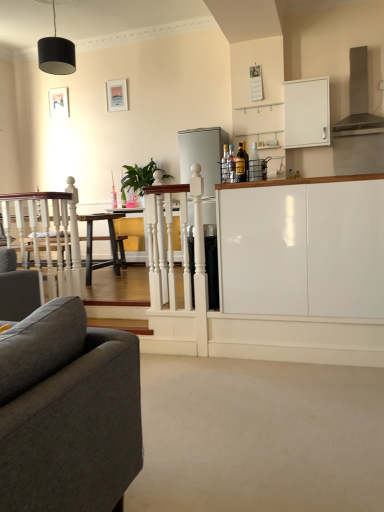
You are a GUI agent. You are given a task and a screenshot of the screen. Output one action in this format:
    pyautogui.click(x=<x>, y=<y>)
    Task: Click on the white wooden railing at center
    Image resolution: width=384 pixels, height=512 pixels.
    Given the screenshot: What is the action you would take?
    (183, 253)

Identify the location of black matte lampshade at upper center. (56, 53).

Measure the distance between black matte lampshade at upper center and camera.

black matte lampshade at upper center and camera are 3.29 meters apart.

At what (x,y) coordinates should I click in order to perform the action: click on satin silver refrigerator at center. Please return your answer as a coordinate pair (x, y). This screenshot has width=384, height=512. Looking at the image, I should click on (202, 155).

The image size is (384, 512). What do you see at coordinates (59, 102) in the screenshot?
I see `matte white picture frame at upper left, placed as the second picture frame when sorted from right to left` at bounding box center [59, 102].

Identify the location of matte white picture frame at upper center, the first picture frame when ordered from front to back. (117, 95).

Describe the element at coordinates (307, 113) in the screenshot. This screenshot has width=384, height=512. I see `white glossy cabinet at upper right, marked as the first cabinetry in a back-to-front arrangement` at that location.

Locate an element on the screen. This screenshot has width=384, height=512. white wooden railing at center is located at coordinates (183, 253).

Who is smaller, white glossy table at center or matte white picture frame at upper left, which ranks as the 2th picture frame in front-to-back order?

matte white picture frame at upper left, which ranks as the 2th picture frame in front-to-back order, is smaller.

Does white glossy table at center have a lesser height compared to matte white picture frame at upper left, which ranks as the 2th picture frame in front-to-back order?

Incorrect, the height of white glossy table at center does not fall short of that of matte white picture frame at upper left, which ranks as the 2th picture frame in front-to-back order.

Is white glossy table at center further to camera compared to matte white picture frame at upper left, placed as the second picture frame when sorted from right to left?

No, it is not.

Is white glossy table at center at the back of satin silver refrigerator at center?

No, satin silver refrigerator at center is not facing away from white glossy table at center.

Is satin silver refrigerator at center not within white glossy table at center?

Indeed, satin silver refrigerator at center is completely outside white glossy table at center.

From the picture: Which object is positioned more to the left, satin silver refrigerator at center or white glossy table at center?

white glossy table at center.

Considering the relative positions of matte gray exhaust hood at upper right and black matte lampshade at upper center in the image provided, is matte gray exhaust hood at upper right to the right of black matte lampshade at upper center from the viewer's perspective?

Yes, matte gray exhaust hood at upper right is to the right of black matte lampshade at upper center.

From a real-world perspective, is matte gray exhaust hood at upper right beneath black matte lampshade at upper center?

Yes, from a real-world perspective, matte gray exhaust hood at upper right is below black matte lampshade at upper center.

Considering the sizes of objects matte gray exhaust hood at upper right and black matte lampshade at upper center in the image provided, who is wider, matte gray exhaust hood at upper right or black matte lampshade at upper center?

matte gray exhaust hood at upper right.

Is matte white picture frame at upper center, the first picture frame when ordered from front to back, to the left of white glossy table at center from the viewer's perspective?

Yes, matte white picture frame at upper center, the first picture frame when ordered from front to back, is to the left of white glossy table at center.

Which object is wider, matte white picture frame at upper center, which appears as the second picture frame when viewed from the back, or white glossy table at center?

With larger width is white glossy table at center.

At what (x,y) coordinates should I click in order to perform the action: click on the 2nd picture frame above the white glossy table at center (from the image's perspective). Please return your answer as a coordinate pair (x, y). This screenshot has height=512, width=384. Looking at the image, I should click on (117, 95).

Would you say matte white picture frame at upper center, which appears as the second picture frame when viewed from the back, is inside or outside white glossy table at center?

matte white picture frame at upper center, which appears as the second picture frame when viewed from the back, cannot be found inside white glossy table at center.

Between white glossy cabinet at upper right, the 1th cabinetry when ordered from top to bottom, and matte white picture frame at upper center, the first picture frame when ordered from front to back, which one is positioned in front?

white glossy cabinet at upper right, the 1th cabinetry when ordered from top to bottom.

Does white glossy cabinet at upper right, which appears as the 2th cabinetry when ordered from the bottom, turn towards matte white picture frame at upper center, which appears as the second picture frame when viewed from the back?

No, white glossy cabinet at upper right, which appears as the 2th cabinetry when ordered from the bottom, is not facing towards matte white picture frame at upper center, which appears as the second picture frame when viewed from the back.

Would you say matte white picture frame at upper center, which appears as the second picture frame when viewed from the back, is part of white glossy cabinet at upper right, which appears as the 2th cabinetry when ordered from the bottom,'s contents?

No, matte white picture frame at upper center, which appears as the second picture frame when viewed from the back, is not inside white glossy cabinet at upper right, which appears as the 2th cabinetry when ordered from the bottom.

Which of these two, white glossy cabinet at upper right, the 1th cabinetry when ordered from top to bottom, or matte white picture frame at upper center, the first picture frame when ordered from front to back, stands shorter?

With less height is matte white picture frame at upper center, the first picture frame when ordered from front to back.

Is matte white picture frame at upper center, which appears as the second picture frame when viewed from the back, in front of white glossy cabinet at center, placed as the first cabinetry when sorted from front to back?

That is False.

Starting from the white glossy cabinet at center, placed as the first cabinetry when sorted from front to back, which picture frame is the 1st one behind? Please provide its 2D coordinates.

[(117, 95)]

Can you confirm if matte white picture frame at upper center, the first picture frame when ordered from front to back, is positioned to the right of white glossy cabinet at center, which appears as the second cabinetry when viewed from the top?

Incorrect, matte white picture frame at upper center, the first picture frame when ordered from front to back, is not on the right side of white glossy cabinet at center, which appears as the second cabinetry when viewed from the top.

From a real-world perspective, which object rests below the other?

white glossy cabinet at center, placed as the first cabinetry when sorted from front to back, is physically lower.

Locate an element on the screen. rail located underneath the black matte lampshade at upper center (from a real-world perspective) is located at coordinates (183, 253).

How many degrees apart are the facing directions of white wooden railing at center and black matte lampshade at upper center?

The angle between the facing direction of white wooden railing at center and the facing direction of black matte lampshade at upper center is 173 degrees.

Is white wooden railing at center further to the viewer compared to black matte lampshade at upper center?

That is False.

Identify the location of table on the right of matte white picture frame at upper left, positioned as the first picture frame in left-to-right order. Image resolution: width=384 pixels, height=512 pixels. (132, 231).

Where is `appliance above the white glossy table at center (from the image's perspective)`? appliance above the white glossy table at center (from the image's perspective) is located at coordinates (x=202, y=155).

Based on their spatial positions, is matte white picture frame at upper left, the first picture frame when ordered from back to front, or white glossy table at center further from black matte lampshade at upper center?

The object further to black matte lampshade at upper center is matte white picture frame at upper left, the first picture frame when ordered from back to front.

From the image, which object appears to be farther from matte white picture frame at upper center, the second picture frame from the left, matte white picture frame at upper left, which ranks as the 2th picture frame in front-to-back order, or black matte lampshade at upper center?

Based on the image, black matte lampshade at upper center appears to be further to matte white picture frame at upper center, the second picture frame from the left.

Considering their positions, is white glossy cabinet at upper right, marked as the first cabinetry in a back-to-front arrangement, positioned further to white wooden railing at center than black matte lampshade at upper center?

Based on the image, white glossy cabinet at upper right, marked as the first cabinetry in a back-to-front arrangement, appears to be further to white wooden railing at center.

Considering their positions, is matte white picture frame at upper left, the first picture frame when ordered from back to front, positioned further to white glossy table at center than white glossy cabinet at upper right, which is counted as the second cabinetry, starting from the front?

white glossy cabinet at upper right, which is counted as the second cabinetry, starting from the front, is further to white glossy table at center.

From the image, which object appears to be nearer to white glossy table at center, white glossy cabinet at center, placed as the 2th cabinetry when sorted from back to front, or matte white picture frame at upper left, the first picture frame when ordered from back to front?

The object closer to white glossy table at center is matte white picture frame at upper left, the first picture frame when ordered from back to front.

Looking at the image, which one is located further to matte white picture frame at upper center, the second picture frame from the left, satin silver refrigerator at center or matte gray exhaust hood at upper right?

Among the two, matte gray exhaust hood at upper right is located further to matte white picture frame at upper center, the second picture frame from the left.

Estimate the real-world distances between objects in this image. Which object is further from matte white picture frame at upper left, placed as the second picture frame when sorted from right to left, white glossy cabinet at upper right, the 1th cabinetry when ordered from top to bottom, or matte white picture frame at upper center, the second picture frame from the left?

Based on the image, white glossy cabinet at upper right, the 1th cabinetry when ordered from top to bottom, appears to be further to matte white picture frame at upper left, placed as the second picture frame when sorted from right to left.

Considering their positions, is matte white picture frame at upper center, which appears as the second picture frame when viewed from the back, positioned closer to matte white picture frame at upper left, positioned as the first picture frame in left-to-right order, than white glossy table at center?

matte white picture frame at upper center, which appears as the second picture frame when viewed from the back, is closer to matte white picture frame at upper left, positioned as the first picture frame in left-to-right order.

At what (x,y) coordinates should I click in order to perform the action: click on appliance between matte white picture frame at upper center, the first picture frame when ordered from front to back, and matte gray exhaust hood at upper right from left to right. Please return your answer as a coordinate pair (x, y). Looking at the image, I should click on (202, 155).

What are the coordinates of `rail between white glossy cabinet at center, placed as the first cabinetry when sorted from front to back, and satin silver refrigerator at center, along the z-axis` in the screenshot? It's located at (183, 253).

This screenshot has height=512, width=384. Find the location of `appliance between black matte lampshade at upper center and white wooden railing at center vertically`. appliance between black matte lampshade at upper center and white wooden railing at center vertically is located at coordinates (202, 155).

The width and height of the screenshot is (384, 512). Find the location of `appliance between matte white picture frame at upper left, positioned as the first picture frame in left-to-right order, and matte gray exhaust hood at upper right, in the horizontal direction`. appliance between matte white picture frame at upper left, positioned as the first picture frame in left-to-right order, and matte gray exhaust hood at upper right, in the horizontal direction is located at coordinates (202, 155).